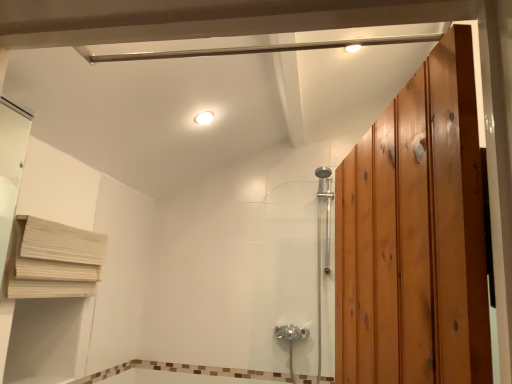
What is the approximate height of chrome metallic shower door at center?

1.25 meters.

The height and width of the screenshot is (384, 512). What do you see at coordinates (185, 371) in the screenshot? I see `brown mosaic tile at lower center` at bounding box center [185, 371].

Locate an element on the screen. This screenshot has width=512, height=384. white glossy light fixture at upper center is located at coordinates pos(204,118).

Considering the positions of point (207, 123) and point (317, 194), is point (207, 123) closer or farther from the camera than point (317, 194)?

Point (207, 123) appears to be closer to the viewer than point (317, 194).

Consider the image. From a real-world perspective, is white glossy light fixture at upper center positioned above or below chrome metallic shower door at center?

In terms of real-world spatial position, white glossy light fixture at upper center is above chrome metallic shower door at center.

Who is shorter, white glossy light fixture at upper center or chrome metallic shower door at center?

white glossy light fixture at upper center.

Which object is closer to the camera taking this photo, white glossy light fixture at upper center or chrome metallic shower door at center?

white glossy light fixture at upper center is closer to the camera.

From the image's perspective, who appears lower, chrome metallic shower door at center or brown mosaic tile at lower center?

brown mosaic tile at lower center appears lower in the image.

From a real-world perspective, is chrome metallic shower door at center beneath brown mosaic tile at lower center?

No, from a real-world perspective, chrome metallic shower door at center is not under brown mosaic tile at lower center.

Is wooden at left wider than chrome metallic shower door at center?

Incorrect, the width of wooden at left does not surpass that of chrome metallic shower door at center.

Looking at this image, which is closer to the camera, (20,221) or (318,211)?

The point (20,221) is in front.

Considering the sizes of wooden at left and chrome metallic shower door at center in the image, is wooden at left taller or shorter than chrome metallic shower door at center?

wooden at left is shorter than chrome metallic shower door at center.

Locate an element on the screen. shower door on the right side of wooden at left is located at coordinates (323, 246).

From a real-world perspective, is brown mosaic tile at lower center beneath white glossy light fixture at upper center?

Correct, in the physical world, brown mosaic tile at lower center is lower than white glossy light fixture at upper center.

Considering the relative sizes of brown mosaic tile at lower center and white glossy light fixture at upper center in the image provided, is brown mosaic tile at lower center shorter than white glossy light fixture at upper center?

Yes, brown mosaic tile at lower center is shorter than white glossy light fixture at upper center.

Measure the distance between brown mosaic tile at lower center and white glossy light fixture at upper center.

They are 1.46 meters apart.

Is point (166, 363) more distant than point (207, 115)?

Yes, it is behind point (207, 115).

Considering the relative sizes of wooden at left and white glossy light fixture at upper center in the image provided, is wooden at left taller than white glossy light fixture at upper center?

Indeed, wooden at left has a greater height compared to white glossy light fixture at upper center.

Which of these two, wooden at left or white glossy light fixture at upper center, is wider?

white glossy light fixture at upper center.

Is wooden at left located outside white glossy light fixture at upper center?

wooden at left is positioned outside white glossy light fixture at upper center.

Considering the positions of objects wooden at left and white glossy light fixture at upper center in the image provided, who is more to the right, wooden at left or white glossy light fixture at upper center?

white glossy light fixture at upper center is more to the right.

Can you tell me how much white glossy light fixture at upper center and brown mosaic tile at lower center differ in facing direction?

95.2 degrees.

Identify the location of light fixture above the brown mosaic tile at lower center (from a real-world perspective). (204, 118).

Is white glossy light fixture at upper center with brown mosaic tile at lower center?

No, white glossy light fixture at upper center is not with brown mosaic tile at lower center.

Is white glossy light fixture at upper center not inside brown mosaic tile at lower center?

Yes, white glossy light fixture at upper center is not within brown mosaic tile at lower center.

This screenshot has width=512, height=384. In order to click on bath below the chrome metallic shower door at center (from a real-world perspective) in this screenshot , I will do `click(185, 371)`.

Based on the photo, from a real-world perspective, which object stands above the other?

chrome metallic shower door at center, from a real-world perspective.

Considering the points (116, 371) and (324, 223), which point is in front, point (116, 371) or point (324, 223)?

Positioned in front is point (116, 371).

Can you confirm if brown mosaic tile at lower center is bigger than chrome metallic shower door at center?

Incorrect, brown mosaic tile at lower center is not larger than chrome metallic shower door at center.

Where is `light fixture in front of the chrome metallic shower door at center`? The height and width of the screenshot is (384, 512). light fixture in front of the chrome metallic shower door at center is located at coordinates (204, 118).

In the image, there is a chrome metallic shower door at center. Identify the location of bath below it (from a real-world perspective). This screenshot has width=512, height=384. (185, 371).

Estimate the real-world distances between objects in this image. Which object is further from wooden at left, brown mosaic tile at lower center or chrome metallic shower door at center?

The object further to wooden at left is chrome metallic shower door at center.

From the image, which object appears to be nearer to white glossy light fixture at upper center, wooden at left or brown mosaic tile at lower center?

wooden at left is positioned closer to the anchor white glossy light fixture at upper center.

Consider the image. Estimate the real-world distances between objects in this image. Which object is closer to brown mosaic tile at lower center, chrome metallic shower door at center or wooden at left?

Among the two, chrome metallic shower door at center is located nearer to brown mosaic tile at lower center.

Considering their positions, is chrome metallic shower door at center positioned closer to brown mosaic tile at lower center than white glossy light fixture at upper center?

Based on the image, chrome metallic shower door at center appears to be nearer to brown mosaic tile at lower center.

Considering their positions, is chrome metallic shower door at center positioned further to wooden at left than brown mosaic tile at lower center?

Among the two, chrome metallic shower door at center is located further to wooden at left.

Looking at the image, which one is located closer to chrome metallic shower door at center, white glossy light fixture at upper center or brown mosaic tile at lower center?

brown mosaic tile at lower center lies closer to chrome metallic shower door at center than the other object.

Based on their spatial positions, is chrome metallic shower door at center or wooden at left closer to white glossy light fixture at upper center?

wooden at left is closer to white glossy light fixture at upper center.

From the image, which object appears to be farther from wooden at left, white glossy light fixture at upper center or chrome metallic shower door at center?

chrome metallic shower door at center lies further to wooden at left than the other object.

The width and height of the screenshot is (512, 384). In order to click on bath situated between wooden at left and chrome metallic shower door at center from left to right in this screenshot , I will do `click(185, 371)`.

This screenshot has height=384, width=512. Identify the location of shower door between white glossy light fixture at upper center and brown mosaic tile at lower center in the vertical direction. (323, 246).

Image resolution: width=512 pixels, height=384 pixels. What are the coordinates of `light fixture between wooden at left and chrome metallic shower door at center from left to right` in the screenshot? It's located at (204, 118).

Find the location of a particular element. This screenshot has height=384, width=512. shelf between white glossy light fixture at upper center and brown mosaic tile at lower center vertically is located at coordinates (53, 260).